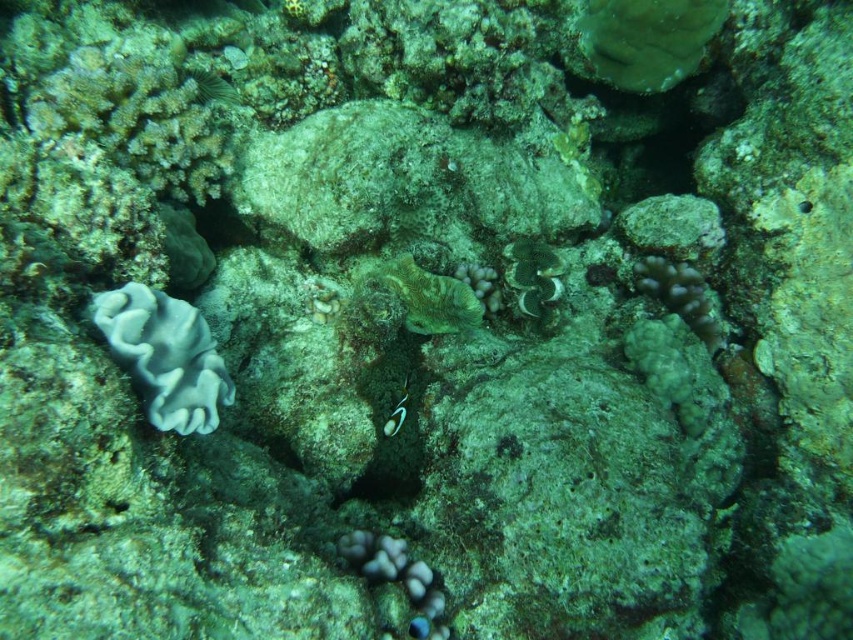
Question: Does smooth coral at center have a lesser width compared to green iridescent fish at center?

Choices:
 (A) yes
 (B) no

Answer: (B)

Question: Is white coral at left to the left of ruffled coral at center from the viewer's perspective?

Choices:
 (A) no
 (B) yes

Answer: (B)

Question: Which of these objects is positioned farthest from the white coral at left?

Choices:
 (A) green iridescent fish at center
 (B) green coral at center
 (C) smooth coral at center
 (D) ruffled coral at center

Answer: (D)

Question: Among these objects, which one is nearest to the camera?

Choices:
 (A) green iridescent fish at center
 (B) smooth coral at center
 (C) white coral at left
 (D) green coral at center

Answer: (C)

Question: Considering the real-world distances, which object is closest to the smooth coral at center?

Choices:
 (A) green iridescent fish at center
 (B) white coral at left

Answer: (A)

Question: Can you confirm if white coral at left is positioned to the right of ruffled coral at center?

Choices:
 (A) yes
 (B) no

Answer: (B)